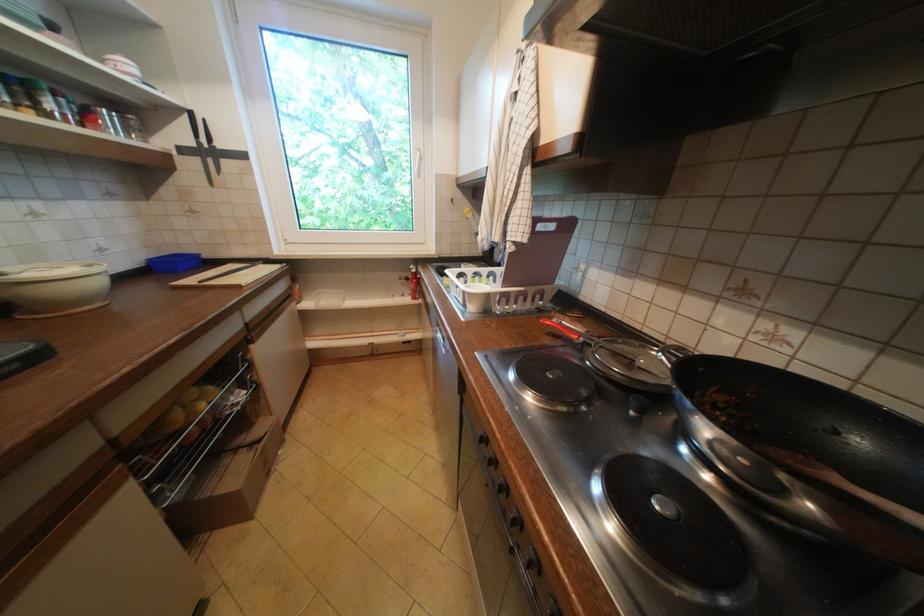
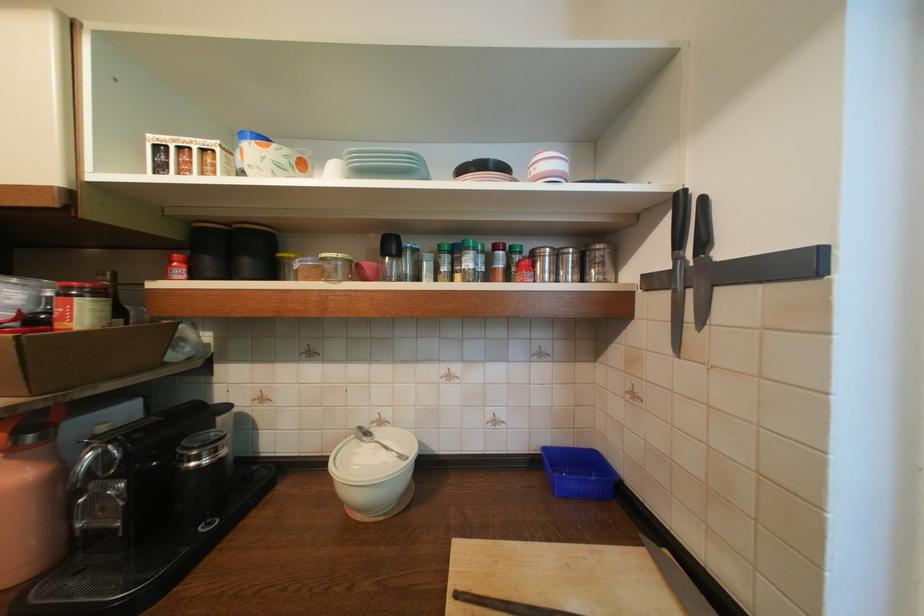
Where in the second image is the point corresponding to the point at 208,145 from the first image?

(686, 261)